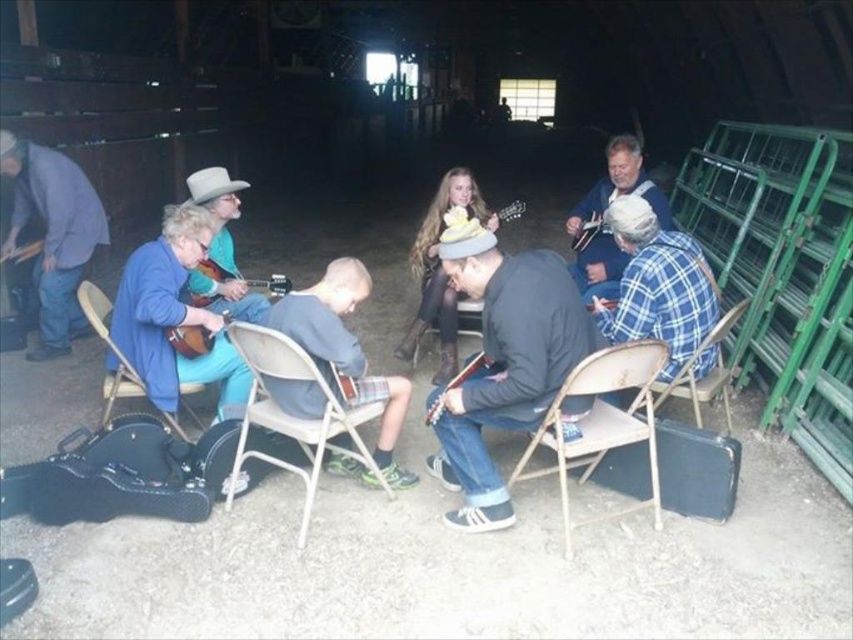
Question: Does metallic silver folding chair at lower center have a larger size compared to metallic silver chair at center?

Choices:
 (A) no
 (B) yes

Answer: (B)

Question: Which object is the closest to the blue plaid shirt at upper right?

Choices:
 (A) wooden acoustic guitar at center
 (B) plaid fabric chair at lower right
 (C) dark gray sweater at center
 (D) metallic silver chair at center

Answer: (B)

Question: Which point is farther from the camera taking this photo?

Choices:
 (A) (65, 186)
 (B) (601, 205)

Answer: (B)

Question: Is the position of dark gray sweater at center more distant than that of light brown leather guitar at center?

Choices:
 (A) yes
 (B) no

Answer: (B)

Question: Does blue denim jacket at left lie in front of metallic silver chair at center?

Choices:
 (A) no
 (B) yes

Answer: (A)

Question: Which object appears closest to the camera in this image?

Choices:
 (A) blue denim jacket at left
 (B) blue plaid shirt at upper right
 (C) wooden acoustic guitar at center

Answer: (C)